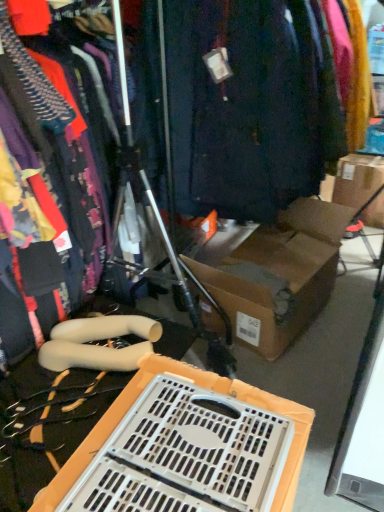
Question: Is dark blue fabric at center directly adjacent to brown cardboard box at upper right?

Choices:
 (A) no
 (B) yes

Answer: (A)

Question: From a real-world perspective, is dark blue fabric at center under brown cardboard box at upper right?

Choices:
 (A) yes
 (B) no

Answer: (B)

Question: Is dark blue fabric at center positioned before brown cardboard box at upper right?

Choices:
 (A) yes
 (B) no

Answer: (A)

Question: Could you tell me if dark blue fabric at center is facing brown cardboard box at upper right?

Choices:
 (A) yes
 (B) no

Answer: (B)

Question: From the image's perspective, is dark blue fabric at center below brown cardboard box at upper right?

Choices:
 (A) yes
 (B) no

Answer: (B)

Question: Considering the relative sizes of dark blue fabric at center and brown cardboard box at upper right in the image provided, is dark blue fabric at center taller than brown cardboard box at upper right?

Choices:
 (A) no
 (B) yes

Answer: (B)

Question: Does white plastic crate at lower center appear on the left side of brown cardboard box at upper right?

Choices:
 (A) no
 (B) yes

Answer: (B)

Question: Can you confirm if white plastic crate at lower center is smaller than brown cardboard box at upper right?

Choices:
 (A) no
 (B) yes

Answer: (B)

Question: Are white plastic crate at lower center and brown cardboard box at upper right located far from each other?

Choices:
 (A) yes
 (B) no

Answer: (A)

Question: From a real-world perspective, is white plastic crate at lower center positioned over brown cardboard box at upper right based on gravity?

Choices:
 (A) yes
 (B) no

Answer: (A)

Question: From the image's perspective, is white plastic crate at lower center below brown cardboard box at upper right?

Choices:
 (A) yes
 (B) no

Answer: (A)

Question: Would you say white plastic crate at lower center is outside brown cardboard box at upper right?

Choices:
 (A) no
 (B) yes

Answer: (B)

Question: Is dark blue fabric at center positioned in front of matte black dress at left?

Choices:
 (A) yes
 (B) no

Answer: (B)